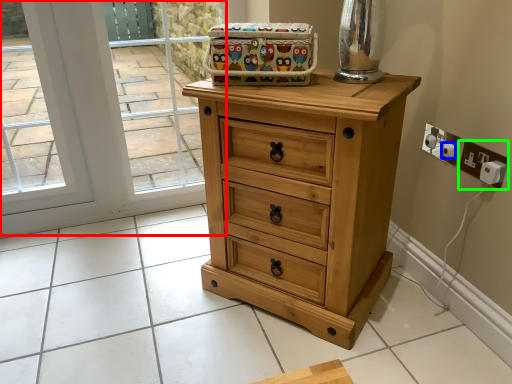
Question: Which is nearer to the glass door (highlighted by a red box)? knob (highlighted by a blue box) or electric outlet (highlighted by a green box).

Choices:
 (A) knob
 (B) electric outlet

Answer: (A)